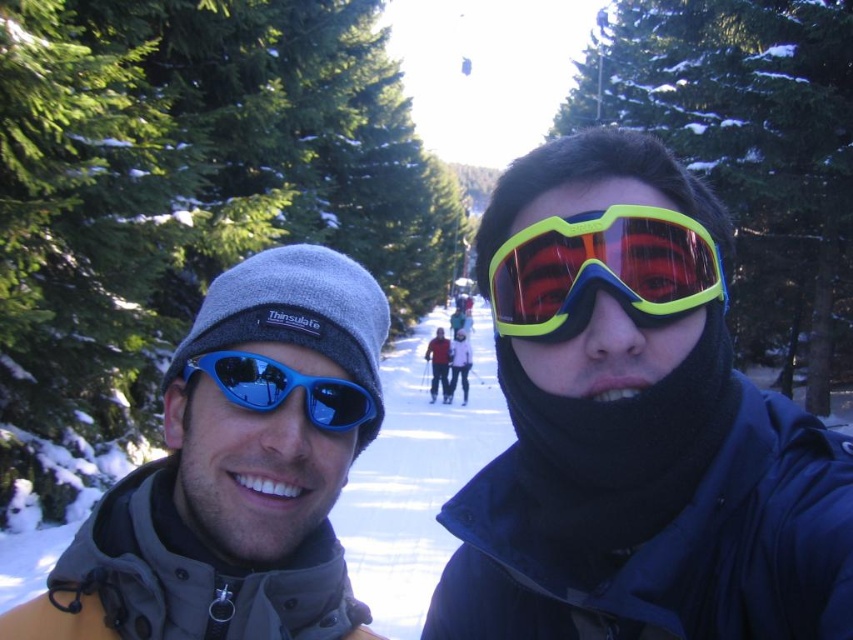
Question: Which point is closer to the camera?

Choices:
 (A) matte blue ski at center
 (B) neon yellow plastic goggles at center
 (C) matte black ski goggles at center
 (D) blue reflective sunglasses at left

Answer: (C)

Question: Which of the following is the closest to the observer?

Choices:
 (A) matte blue sunglasses at left
 (B) matte black ski goggles at center
 (C) blue reflective sunglasses at left
 (D) neon yellow plastic goggles at center

Answer: (B)

Question: Among these points, which one is nearest to the camera?

Choices:
 (A) (434, 396)
 (B) (711, 241)
 (C) (451, 387)
 (D) (119, 504)

Answer: (D)

Question: Is matte black ski goggles at center behind matte blue sunglasses at center?

Choices:
 (A) no
 (B) yes

Answer: (A)

Question: Considering the relative positions of neon yellow plastic goggles at center and blue reflective sunglasses at left in the image provided, where is neon yellow plastic goggles at center located with respect to blue reflective sunglasses at left?

Choices:
 (A) right
 (B) left

Answer: (A)

Question: Is matte blue sunglasses at left further to camera compared to matte blue ski at center?

Choices:
 (A) yes
 (B) no

Answer: (B)